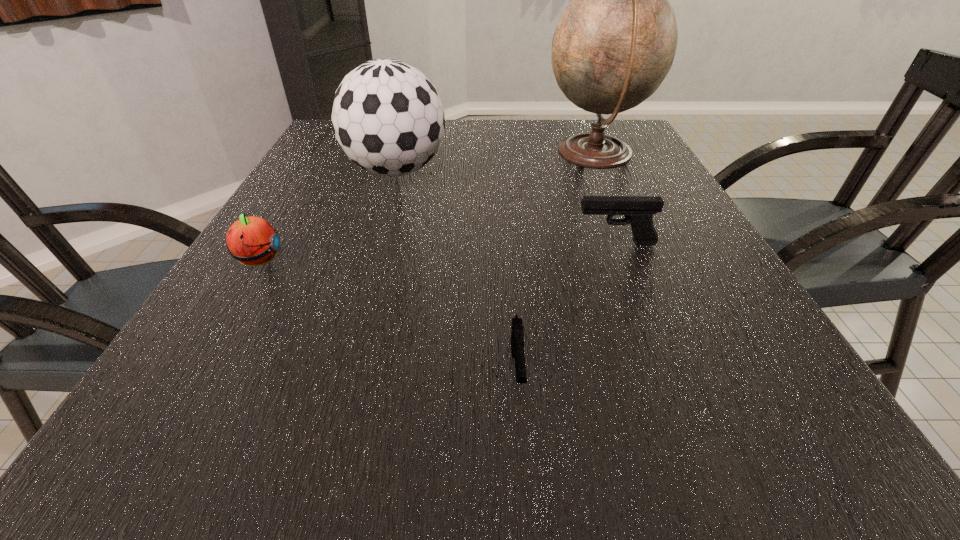
At what (x,y) coordinates should I click in order to perform the action: click on vacant area between the leftmost object and the farther pistol. Please return your answer as a coordinate pair (x, y). Image resolution: width=960 pixels, height=540 pixels. Looking at the image, I should click on (437, 252).

Identify which object is located as the second nearest to the shorter pistol. Please provide its 2D coordinates. Your answer should be formatted as a tuple, i.e. [(x, y)], where the tuple contains the x and y coordinates of a point satisfying the conditions above.

[(251, 240)]

You are a GUI agent. You are given a task and a screenshot of the screen. Output one action in this format:
    pyautogui.click(x=<x>, y=<y>)
    Task: Click on the object that stands as the fourth closest to the shorter pistol
    This screenshot has width=960, height=540.
    Given the screenshot: What is the action you would take?
    pyautogui.click(x=615, y=43)

Identify the location of free location that satisfies the following two spatial constraints: 1. on the front-facing side of the globe; 2. on the front-facing side of the left pistol. (688, 370).

Where is `free point that satisfies the following two spatial constraints: 1. on the front-facing side of the globe; 2. on the front side of the fourth shortest object`? The image size is (960, 540). free point that satisfies the following two spatial constraints: 1. on the front-facing side of the globe; 2. on the front side of the fourth shortest object is located at coordinates (602, 171).

The image size is (960, 540). What are the coordinates of `vacant space that satisfies the following two spatial constraints: 1. on the front-facing side of the farther pistol; 2. on the front-facing side of the left pistol` in the screenshot? It's located at (664, 370).

Locate an element on the screen. The height and width of the screenshot is (540, 960). vacant area in the image that satisfies the following two spatial constraints: 1. on the front-facing side of the globe; 2. on the front-facing side of the shortest object is located at coordinates (688, 370).

Where is `vacant space that satisfies the following two spatial constraints: 1. on the front-facing side of the farther pistol; 2. on the front-facing side of the nearer pistol`? vacant space that satisfies the following two spatial constraints: 1. on the front-facing side of the farther pistol; 2. on the front-facing side of the nearer pistol is located at coordinates (664, 370).

Where is `vacant region that satisfies the following two spatial constraints: 1. on the front-facing side of the taller pistol; 2. on the front-facing side of the nearest object`? The image size is (960, 540). vacant region that satisfies the following two spatial constraints: 1. on the front-facing side of the taller pistol; 2. on the front-facing side of the nearest object is located at coordinates (664, 370).